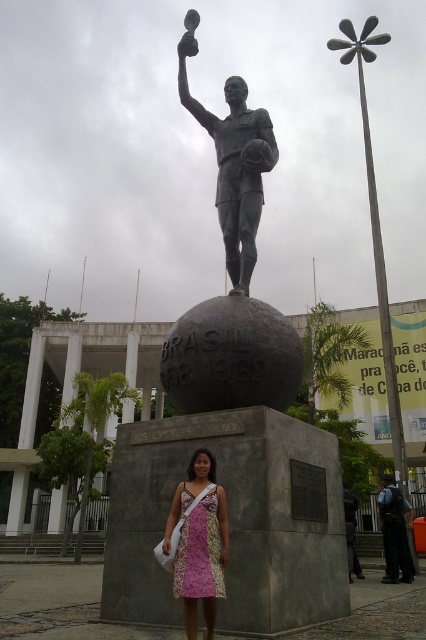
You are a photographer at the statue of Brazil World Cup victories. You see a person wearing a pink floral dress at center and another in a dark blue uniform at center. Which clothing item is shorter in height?

The pink floral dress at center has a lesser height compared to the dark blue uniform at center, so the pink floral dress at center is shorter in height.

You are a tour guide explaining the statue of a football player standing atop a globe. Where exactly is the polished bronze statue at center located in terms of coordinates?

The polished bronze statue at center is located at coordinates point (232, 275).